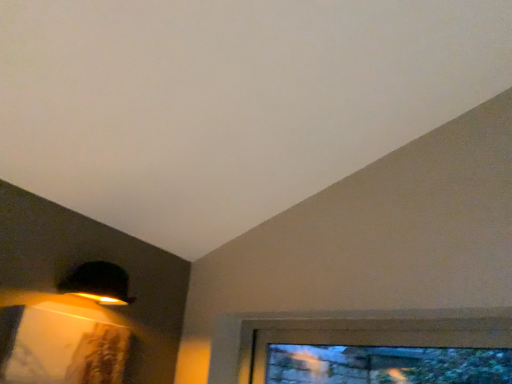
Measure the distance between matte black lampshade at upper left and camera.

matte black lampshade at upper left is 1.41 meters away from camera.

Identify the location of matte black lampshade at upper left. (98, 283).

What do you see at coordinates (98, 283) in the screenshot? I see `matte black lampshade at upper left` at bounding box center [98, 283].

Find the location of a particular element. This screenshot has height=384, width=512. clear glass window at lower right is located at coordinates (347, 334).

This screenshot has width=512, height=384. What do you see at coordinates (347, 334) in the screenshot? I see `clear glass window at lower right` at bounding box center [347, 334].

Measure the distance between clear glass window at lower right and camera.

→ clear glass window at lower right is 4.45 feet away from camera.

Identify the location of matte black lampshade at upper left. Image resolution: width=512 pixels, height=384 pixels. 98,283.

Is clear glass window at lower right to the right of matte black lampshade at upper left from the viewer's perspective?

Yes, clear glass window at lower right is to the right of matte black lampshade at upper left.

Which object is closer to the camera taking this photo, clear glass window at lower right or matte black lampshade at upper left?

clear glass window at lower right.

Which point is more distant from viewer, (x=424, y=340) or (x=88, y=277)?

Point (x=424, y=340)

From the image's perspective, is clear glass window at lower right beneath matte black lampshade at upper left?

Yes, from the image's perspective, clear glass window at lower right is below matte black lampshade at upper left.

From a real-world perspective, is clear glass window at lower right located beneath matte black lampshade at upper left?

Yes, from a real-world perspective, clear glass window at lower right is under matte black lampshade at upper left.

Considering the relative sizes of clear glass window at lower right and matte black lampshade at upper left in the image provided, is clear glass window at lower right wider than matte black lampshade at upper left?

No.

Who is shorter, clear glass window at lower right or matte black lampshade at upper left?

Standing shorter between the two is matte black lampshade at upper left.

Between clear glass window at lower right and matte black lampshade at upper left, which one has larger size?

clear glass window at lower right is bigger.

Choose the correct answer: Is clear glass window at lower right inside matte black lampshade at upper left or outside it?

clear glass window at lower right exists outside the volume of matte black lampshade at upper left.

Is clear glass window at lower right beside matte black lampshade at upper left?

There is a gap between clear glass window at lower right and matte black lampshade at upper left.

Is clear glass window at lower right oriented away from matte black lampshade at upper left?

No.

At what (x,y) coordinates should I click in order to perform the action: click on lamp on the left of the clear glass window at lower right. Please return your answer as a coordinate pair (x, y). Image resolution: width=512 pixels, height=384 pixels. Looking at the image, I should click on (98, 283).

Is matte black lampshade at upper left at the left side of clear glass window at lower right?

Indeed, matte black lampshade at upper left is positioned on the left side of clear glass window at lower right.

Which object is more forward, matte black lampshade at upper left or clear glass window at lower right?

clear glass window at lower right is more forward.

Is point (112, 283) closer to viewer compared to point (393, 324)?

That is True.

From the image's perspective, is matte black lampshade at upper left above clear glass window at lower right?

Yes, from the image's perspective, matte black lampshade at upper left is on top of clear glass window at lower right.

From a real-world perspective, is matte black lampshade at upper left positioned under clear glass window at lower right based on gravity?

No, from a real-world perspective, matte black lampshade at upper left is not beneath clear glass window at lower right.

Looking at their sizes, would you say matte black lampshade at upper left is wider or thinner than clear glass window at lower right?

matte black lampshade at upper left is wider than clear glass window at lower right.

Between matte black lampshade at upper left and clear glass window at lower right, which one has more height?

clear glass window at lower right.

Based on their sizes in the image, would you say matte black lampshade at upper left is bigger or smaller than clear glass window at lower right?

Clearly, matte black lampshade at upper left is smaller in size than clear glass window at lower right.

Would you say matte black lampshade at upper left is inside or outside clear glass window at lower right?

The correct answer is: outside.

Is matte black lampshade at upper left not close to clear glass window at lower right?

matte black lampshade at upper left is actually quite close to clear glass window at lower right.

From the picture: Is matte black lampshade at upper left positioned with its back to clear glass window at lower right?

No, clear glass window at lower right is not at the back of matte black lampshade at upper left.

Find the location of `lamp behind the clear glass window at lower right`. lamp behind the clear glass window at lower right is located at coordinates (98, 283).

Locate an element on the screen. Image resolution: width=512 pixels, height=384 pixels. window below the matte black lampshade at upper left (from the image's perspective) is located at coordinates (347, 334).

Find the location of `lamp located behind the clear glass window at lower right`. lamp located behind the clear glass window at lower right is located at coordinates (98, 283).